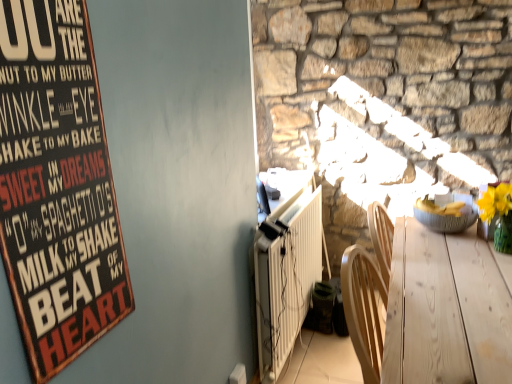
Locate an element on the screen. light wood table at lower right is located at coordinates (445, 311).

This screenshot has height=384, width=512. What do you see at coordinates (57, 186) in the screenshot?
I see `wooden signboard at upper left` at bounding box center [57, 186].

At what (x,y) coordinates should I click in order to perform the action: click on light wood table at lower right. Please return your answer as a coordinate pair (x, y). This screenshot has width=512, height=384. Looking at the image, I should click on (445, 311).

Is wooden signboard at upper left next to light wood table at lower right and touching it?

No, wooden signboard at upper left is not beside light wood table at lower right.

Between point (97, 257) and point (400, 261), which one is positioned behind?

The point (400, 261) is behind.

Is the position of wooden signboard at upper left more distant than that of light wood table at lower right?

No, it is in front of light wood table at lower right.

From a real-world perspective, which is physically below, wooden signboard at upper left or light wood table at lower right?

light wood table at lower right.

Is point (317, 219) closer or farther from the camera than point (464, 254)?

Clearly, point (317, 219) is more distant from the camera than point (464, 254).

How many degrees apart are the facing directions of white textured radiator at lower center and light wood table at lower right?

The angle between the facing direction of white textured radiator at lower center and the facing direction of light wood table at lower right is 0.0283 degrees.

Considering the relative sizes of white textured radiator at lower center and light wood table at lower right in the image provided, is white textured radiator at lower center wider than light wood table at lower right?

No, white textured radiator at lower center is not wider than light wood table at lower right.

Which is more to the right, matte gray bowl at right or wooden signboard at upper left?

matte gray bowl at right is more to the right.

Who is smaller, matte gray bowl at right or wooden signboard at upper left?

Smaller between the two is wooden signboard at upper left.

Is matte gray bowl at right thinner than wooden signboard at upper left?

Incorrect, the width of matte gray bowl at right is not less than that of wooden signboard at upper left.

How far apart are matte gray bowl at right and wooden signboard at upper left?

matte gray bowl at right is 1.61 meters from wooden signboard at upper left.

Is matte gray bowl at right wider or thinner than light wood table at lower right?

Considering their sizes, matte gray bowl at right looks slimmer than light wood table at lower right.

From the image's perspective, between matte gray bowl at right and light wood table at lower right, which one is located above?

matte gray bowl at right appears higher in the image.

Considering the relative sizes of matte gray bowl at right and light wood table at lower right in the image provided, is matte gray bowl at right bigger than light wood table at lower right?

No.

Is matte gray bowl at right not near light wood table at lower right?

matte gray bowl at right is near light wood table at lower right, not far away.

From the image's perspective, does light wood table at lower right appear lower than white textured radiator at lower center?

Indeed, from the image's perspective, light wood table at lower right is shown beneath white textured radiator at lower center.

Between point (454, 266) and point (293, 345), which one is positioned behind?

The point (293, 345) is more distant.

Which of these two, light wood table at lower right or white textured radiator at lower center, is wider?

light wood table at lower right.

Can you confirm if light wood table at lower right is positioned to the left of white textured radiator at lower center?

In fact, light wood table at lower right is to the right of white textured radiator at lower center.

Can we say white textured radiator at lower center lies outside wooden signboard at upper left?

Yes, white textured radiator at lower center is located beyond the bounds of wooden signboard at upper left.

Is wooden signboard at upper left at the back of white textured radiator at lower center?

No, white textured radiator at lower center is not facing away from wooden signboard at upper left.

Considering the relative positions of white textured radiator at lower center and wooden signboard at upper left in the image provided, is white textured radiator at lower center behind wooden signboard at upper left?

Yes, white textured radiator at lower center is behind wooden signboard at upper left.

Which is behind, point (453, 362) or point (53, 314)?

The point (453, 362) is more distant.

Is light wood table at lower right inside or outside of wooden signboard at upper left?

The correct answer is: outside.

From the picture: Considering the relative sizes of light wood table at lower right and wooden signboard at upper left in the image provided, is light wood table at lower right taller than wooden signboard at upper left?

Correct, light wood table at lower right is much taller as wooden signboard at upper left.

Where is `poster that appears on the left of light wood table at lower right`? The width and height of the screenshot is (512, 384). poster that appears on the left of light wood table at lower right is located at coordinates (57, 186).

Where is `radiator above the light wood table at lower right (from the image's perspective)`? The image size is (512, 384). radiator above the light wood table at lower right (from the image's perspective) is located at coordinates (286, 277).

From the image, which object appears to be nearer to light wood table at lower right, wooden signboard at upper left or matte gray bowl at right?

Based on the image, matte gray bowl at right appears to be nearer to light wood table at lower right.

Which object lies nearer to the anchor point wooden signboard at upper left, light wood table at lower right or white textured radiator at lower center?

The object closer to wooden signboard at upper left is light wood table at lower right.

Which object lies nearer to the anchor point white textured radiator at lower center, light wood table at lower right or wooden signboard at upper left?

Based on the image, light wood table at lower right appears to be nearer to white textured radiator at lower center.

Looking at the image, which one is located closer to white textured radiator at lower center, wooden signboard at upper left or light wood table at lower right?

light wood table at lower right.

Estimate the real-world distances between objects in this image. Which object is further from wooden signboard at upper left, light wood table at lower right or matte gray bowl at right?

matte gray bowl at right lies further to wooden signboard at upper left than the other object.

Based on their spatial positions, is white textured radiator at lower center or matte gray bowl at right closer to wooden signboard at upper left?

white textured radiator at lower center is closer to wooden signboard at upper left.

Based on their spatial positions, is white textured radiator at lower center or light wood table at lower right further from wooden signboard at upper left?

white textured radiator at lower center lies further to wooden signboard at upper left than the other object.

Considering their positions, is wooden signboard at upper left positioned further to matte gray bowl at right than light wood table at lower right?

The object further to matte gray bowl at right is wooden signboard at upper left.

Find the location of a particular element. desk between wooden signboard at upper left and white textured radiator at lower center from front to back is located at coordinates (445, 311).

Locate an element on the screen. This screenshot has height=384, width=512. radiator between wooden signboard at upper left and matte gray bowl at right in the front-back direction is located at coordinates (286, 277).

Where is `desk located between white textured radiator at lower center and matte gray bowl at right in the left-right direction`? desk located between white textured radiator at lower center and matte gray bowl at right in the left-right direction is located at coordinates (445, 311).

Locate an element on the screen. desk located between wooden signboard at upper left and matte gray bowl at right in the left-right direction is located at coordinates (445, 311).